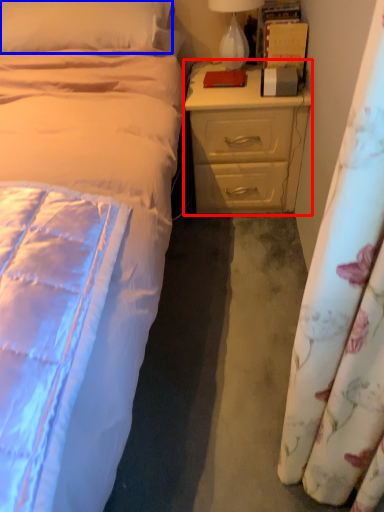
Question: Which point is closer to the camera, nightstand (highlighted by a red box) or pillow (highlighted by a blue box)?

Choices:
 (A) nightstand
 (B) pillow

Answer: (B)